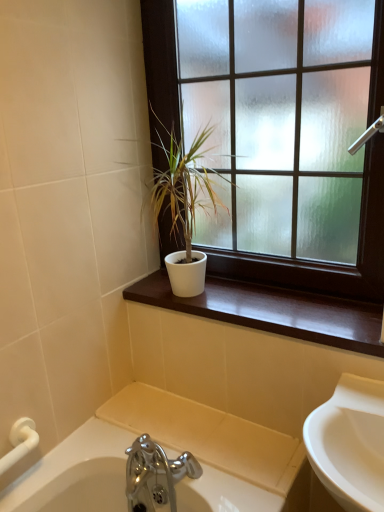
Question: Should I look upward or downward to see white matte window at upper center?

Choices:
 (A) up
 (B) down

Answer: (A)

Question: Is white matte pot at center surrounding white matte window at upper center?

Choices:
 (A) no
 (B) yes

Answer: (A)

Question: From the image's perspective, does white matte pot at center appear lower than white matte window at upper center?

Choices:
 (A) no
 (B) yes

Answer: (B)

Question: From a real-world perspective, is white matte pot at center positioned over white matte window at upper center based on gravity?

Choices:
 (A) yes
 (B) no

Answer: (B)

Question: Considering the relative sizes of white matte pot at center and white matte window at upper center in the image provided, is white matte pot at center thinner than white matte window at upper center?

Choices:
 (A) no
 (B) yes

Answer: (A)

Question: Does white matte pot at center have a greater width compared to white matte window at upper center?

Choices:
 (A) yes
 (B) no

Answer: (A)

Question: Is white matte pot at center further to the viewer compared to white matte window at upper center?

Choices:
 (A) yes
 (B) no

Answer: (A)

Question: Does white matte pot at center have a lesser height compared to white glossy window sill at center?

Choices:
 (A) no
 (B) yes

Answer: (A)

Question: Considering the relative sizes of white matte pot at center and white glossy window sill at center in the image provided, is white matte pot at center wider than white glossy window sill at center?

Choices:
 (A) yes
 (B) no

Answer: (A)

Question: Is white matte pot at center outside white glossy window sill at center?

Choices:
 (A) no
 (B) yes

Answer: (B)

Question: Is white matte pot at center oriented away from white glossy window sill at center?

Choices:
 (A) yes
 (B) no

Answer: (B)

Question: From a real-world perspective, is white matte pot at center positioned over white glossy window sill at center based on gravity?

Choices:
 (A) yes
 (B) no

Answer: (A)

Question: From the image's perspective, does white matte pot at center appear lower than white glossy window sill at center?

Choices:
 (A) yes
 (B) no

Answer: (B)

Question: From a real-world perspective, is white matte window at upper center physically above white matte pot at center?

Choices:
 (A) no
 (B) yes

Answer: (B)